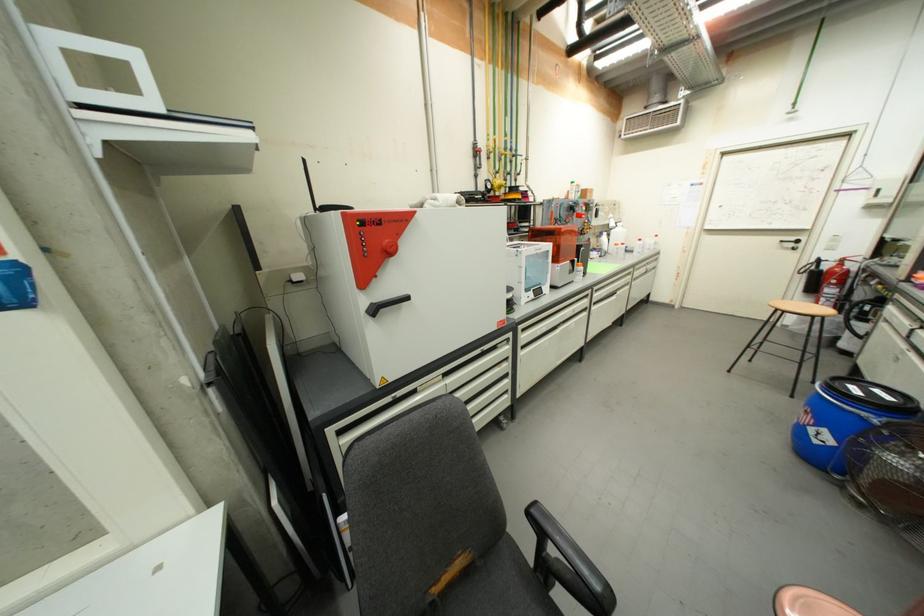
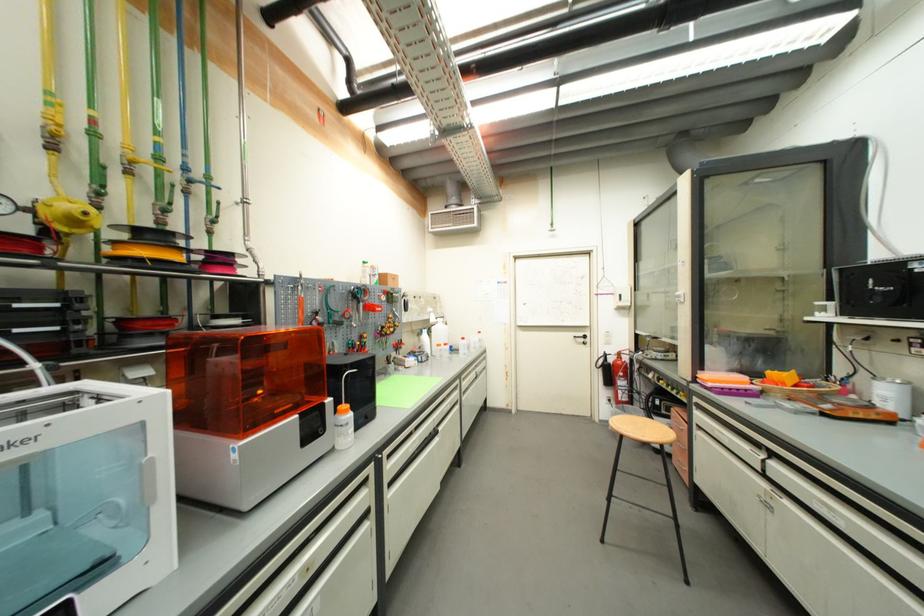
Where in the second image is the point corresponding to [505,188] from the first image?

(82, 224)